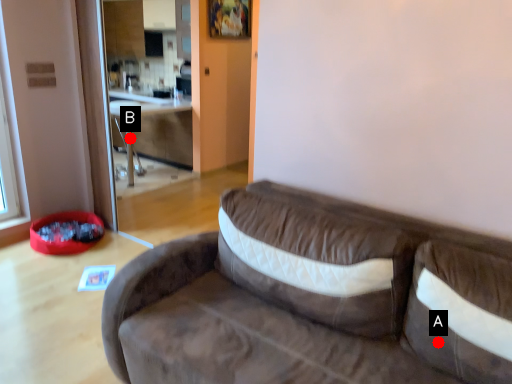
Question: Two points are circled on the image, labeled by A and B beside each circle. Among these points, which one is farthest from the camera?

Choices:
 (A) A is further
 (B) B is further

Answer: (B)